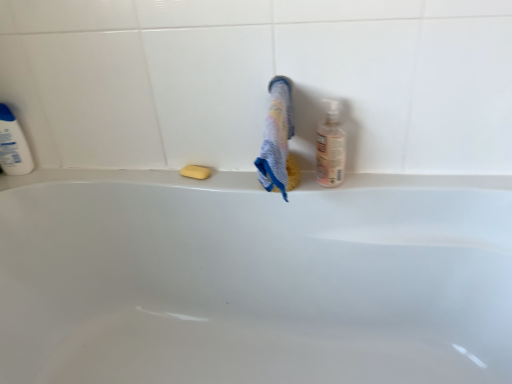
Where is `free space to the left of yellow matte soap at center`? The width and height of the screenshot is (512, 384). free space to the left of yellow matte soap at center is located at coordinates (148, 172).